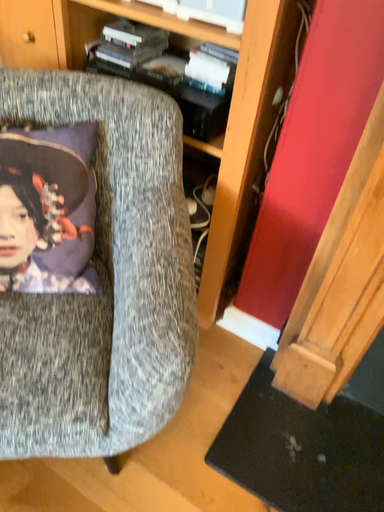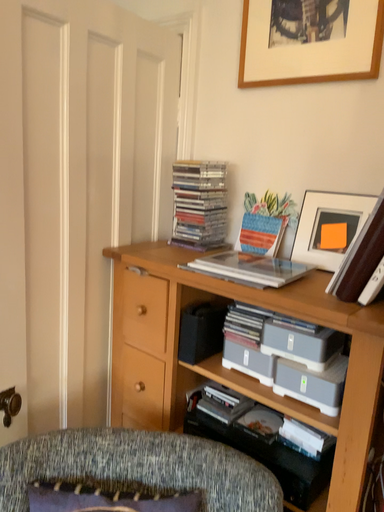
Question: Which way did the camera rotate in the video?

Choices:
 (A) rotated downward
 (B) rotated upward

Answer: (B)